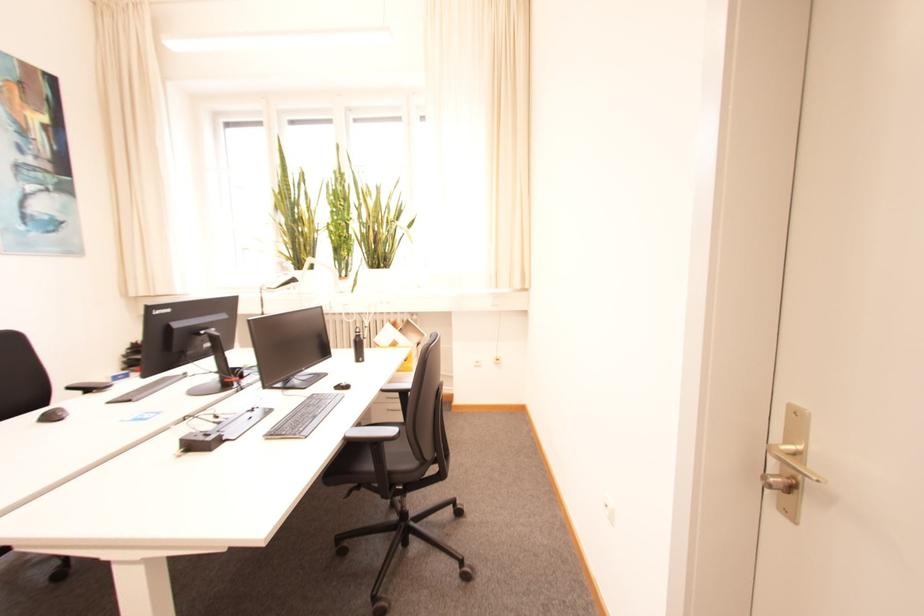
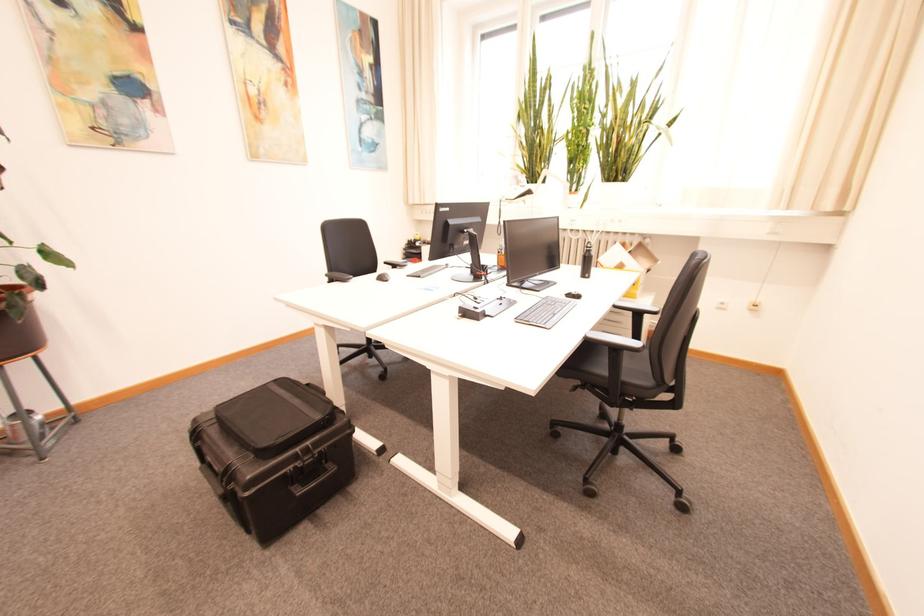
Locate, in the second image, the point that corresponds to point 271,436 in the first image.

(523, 320)